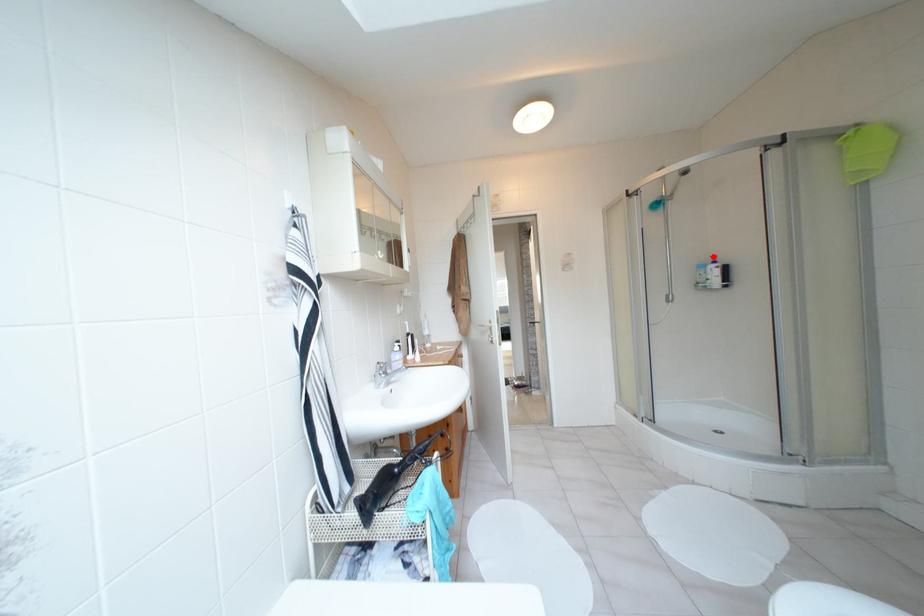
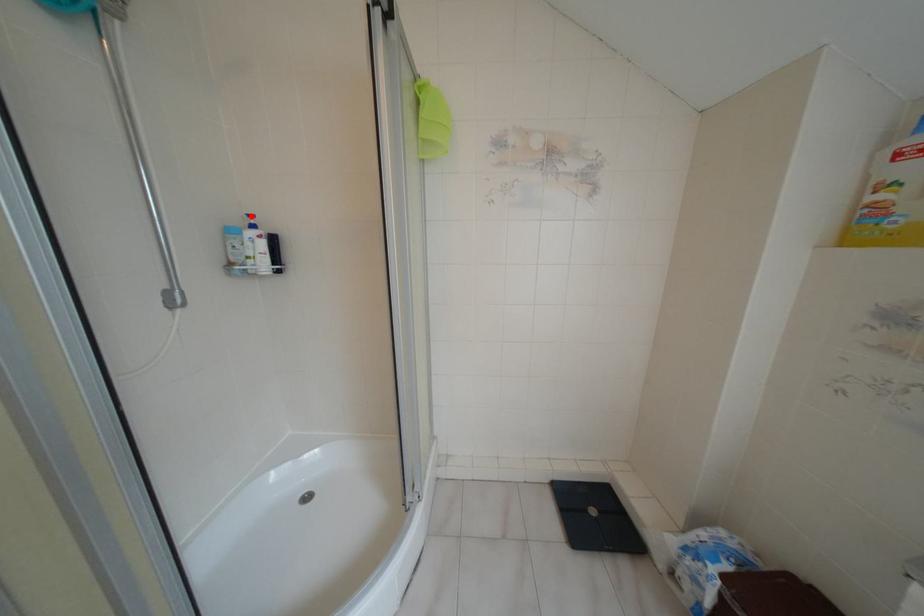
I am providing you with two images of the same scene from different viewpoints. A red point is marked on the first image and another point is marked on the second image. Do the highlighted points in image1 and image2 indicate the same real-world spot?

Yes